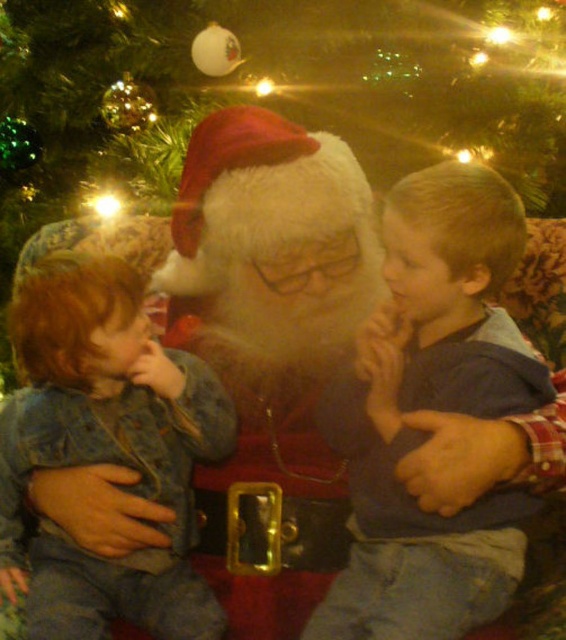
Can you confirm if blue denim shirt at center is positioned below faded denim jacket at lower left?

No, blue denim shirt at center is not below faded denim jacket at lower left.

Consider the image. Between blue denim shirt at center and faded denim jacket at lower left, which one has more height?

With more height is blue denim shirt at center.

This screenshot has width=566, height=640. I want to click on blue denim shirt at center, so click(431, 410).